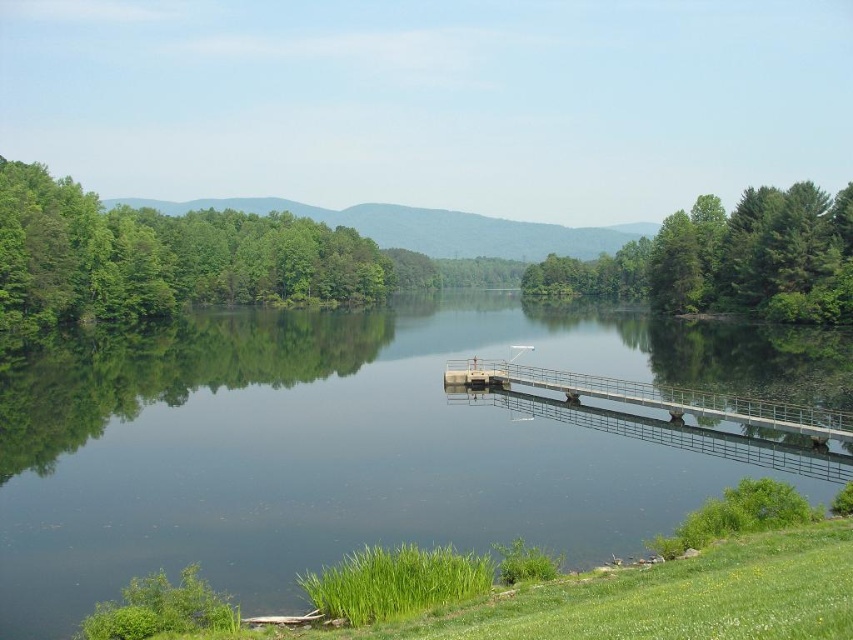
You are planning to take a photo of the clear glass water at center and the metallic gray bridge at center from the lakeside. Which object should you place on the left side of your camera frame to capture both in the scene?

You should place the clear glass water at center on the left side of your camera frame since it is already positioned on the left side of the metallic gray bridge at center in the scene.

You are standing at the lakeside and want to reach the point marked as point (219, 509). Given that the dock is 10 meters long, can you walk directly to that point from where you are?

The distance between you and point (219, 509) is 23.54 meters. Since the dock is only 10 meters long, you cannot reach that point by walking directly on the dock.